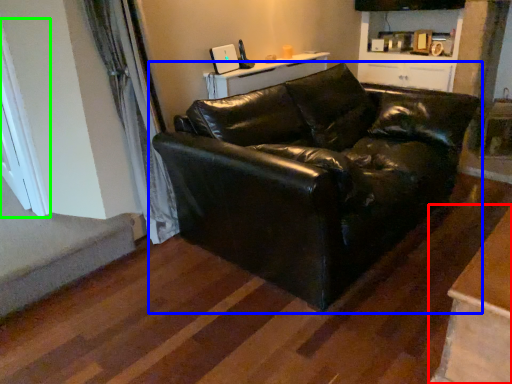
Question: Which object is positioned closest to table (highlighted by a red box)? Select from studio couch (highlighted by a blue box) and window (highlighted by a green box).

Choices:
 (A) studio couch
 (B) window

Answer: (A)